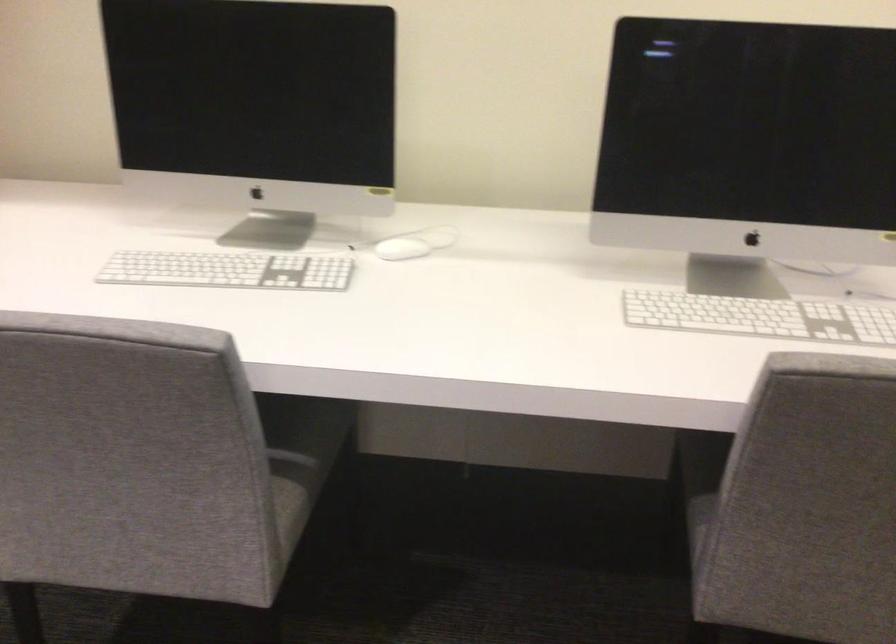
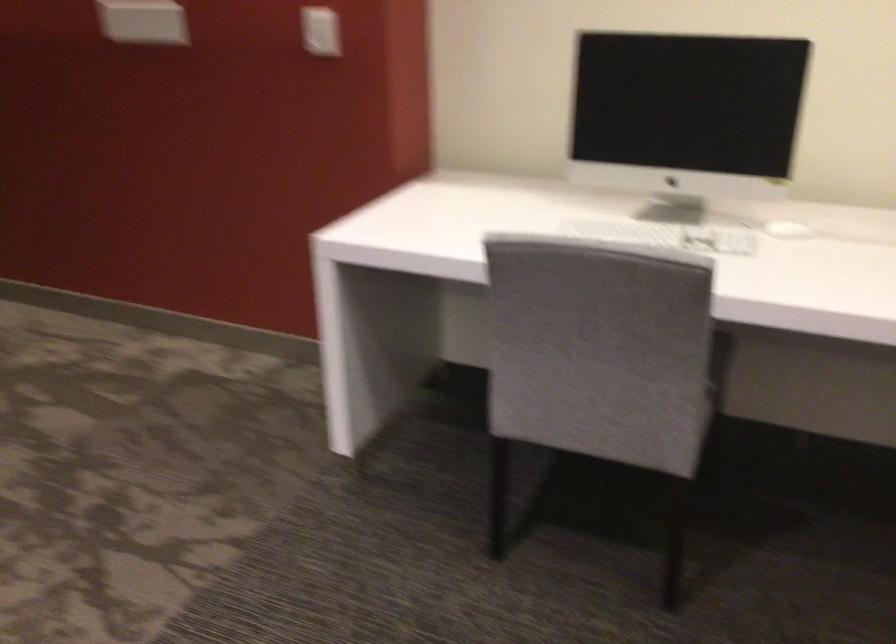
In the second image, find the point that corresponds to [252,274] in the first image.

(666, 234)